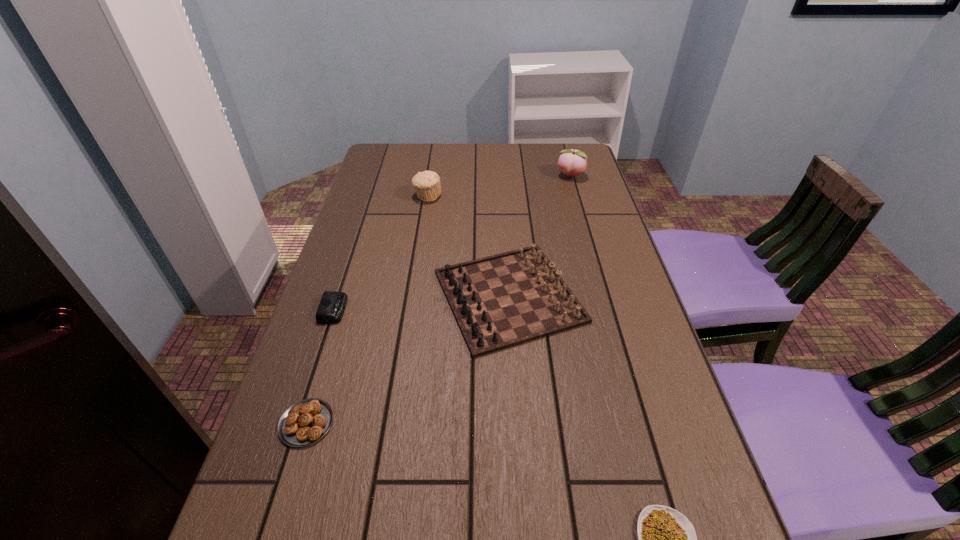
This screenshot has width=960, height=540. What are the coordinates of `free region located 0.120m on the right of the fifth farthest object` in the screenshot? It's located at (396, 423).

You are a GUI agent. You are given a task and a screenshot of the screen. Output one action in this format:
    pyautogui.click(x=<x>, y=<y>)
    Task: Click on the free space located 0.300m on the display of the alarm clock
    This screenshot has height=540, width=960.
    Given the screenshot: What is the action you would take?
    pyautogui.click(x=468, y=309)

In order to click on object that is at the far edge in this screenshot , I will do `click(572, 162)`.

Locate an element on the screen. This screenshot has height=540, width=960. pastry that is at the left edge is located at coordinates (305, 422).

The height and width of the screenshot is (540, 960). Identify the location of alarm clock at the left edge. (332, 305).

You are a GUI agent. You are given a task and a screenshot of the screen. Output one action in this format:
    pyautogui.click(x=<x>, y=<y>)
    Task: Click on the peach positioned at the right edge
    
    Given the screenshot: What is the action you would take?
    pyautogui.click(x=572, y=162)

Where is `chessboard that is at the right edge`? This screenshot has height=540, width=960. chessboard that is at the right edge is located at coordinates (503, 300).

This screenshot has height=540, width=960. In order to click on object at the far right corner in this screenshot , I will do `click(572, 162)`.

Locate an element on the screen. free spot at the far edge of the desktop is located at coordinates (471, 150).

At what (x,y) coordinates should I click in order to perform the action: click on vacant area at the left edge of the desktop. Please return your answer as a coordinate pair (x, y). Looking at the image, I should click on (340, 254).